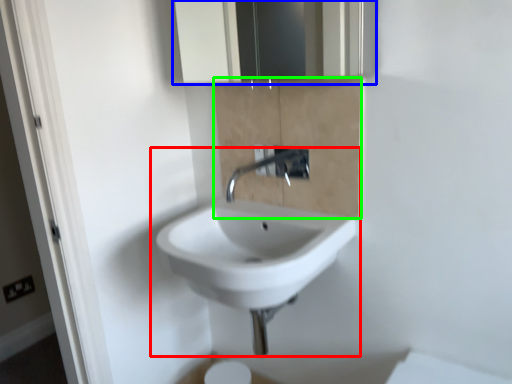
Question: Considering the real-world distances, which object is closest to sink (highlighted by a red box)? medicine cabinet (highlighted by a blue box) or cabinetry (highlighted by a green box).

Choices:
 (A) medicine cabinet
 (B) cabinetry

Answer: (B)